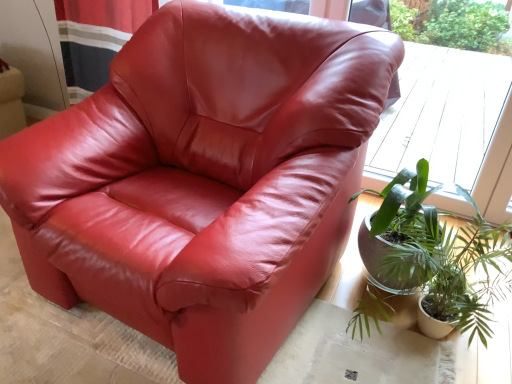
Identify the location of blank area beneath green leafy plant at lower right (from a real-world perspective). The height and width of the screenshot is (384, 512). (422, 350).